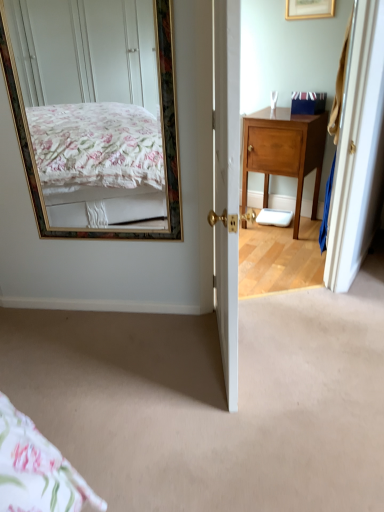
Question: Is wooden cabinet at right smaller than carpet at center?

Choices:
 (A) yes
 (B) no

Answer: (B)

Question: Considering the relative sizes of wooden cabinet at right and carpet at center in the image provided, is wooden cabinet at right shorter than carpet at center?

Choices:
 (A) no
 (B) yes

Answer: (A)

Question: Is wooden cabinet at right at the right side of carpet at center?

Choices:
 (A) no
 (B) yes

Answer: (B)

Question: From the image's perspective, is wooden cabinet at right on top of carpet at center?

Choices:
 (A) yes
 (B) no

Answer: (A)

Question: Is wooden cabinet at right wider than carpet at center?

Choices:
 (A) yes
 (B) no

Answer: (B)

Question: Considering the positions of gold-framed mirror at upper left and blue cardboard box at upper right in the image, is gold-framed mirror at upper left wider or thinner than blue cardboard box at upper right?

Choices:
 (A) thin
 (B) wide

Answer: (A)

Question: In terms of size, does gold-framed mirror at upper left appear bigger or smaller than blue cardboard box at upper right?

Choices:
 (A) small
 (B) big

Answer: (B)

Question: Relative to blue cardboard box at upper right, is gold-framed mirror at upper left in front or behind?

Choices:
 (A) behind
 (B) front

Answer: (B)

Question: Would you say gold-framed mirror at upper left is inside or outside blue cardboard box at upper right?

Choices:
 (A) outside
 (B) inside

Answer: (A)

Question: In terms of size, does carpet at center appear bigger or smaller than blue cardboard box at upper right?

Choices:
 (A) small
 (B) big

Answer: (B)

Question: From their relative heights in the image, would you say carpet at center is taller or shorter than blue cardboard box at upper right?

Choices:
 (A) tall
 (B) short

Answer: (B)

Question: From a real-world perspective, relative to blue cardboard box at upper right, is carpet at center vertically above or below?

Choices:
 (A) above
 (B) below

Answer: (B)

Question: Considering their positions, is carpet at center located in front of or behind blue cardboard box at upper right?

Choices:
 (A) behind
 (B) front

Answer: (B)

Question: Is wooden cabinet at right wider or thinner than carpet at center?

Choices:
 (A) wide
 (B) thin

Answer: (B)

Question: Visually, is wooden cabinet at right positioned to the left or to the right of carpet at center?

Choices:
 (A) right
 (B) left

Answer: (A)